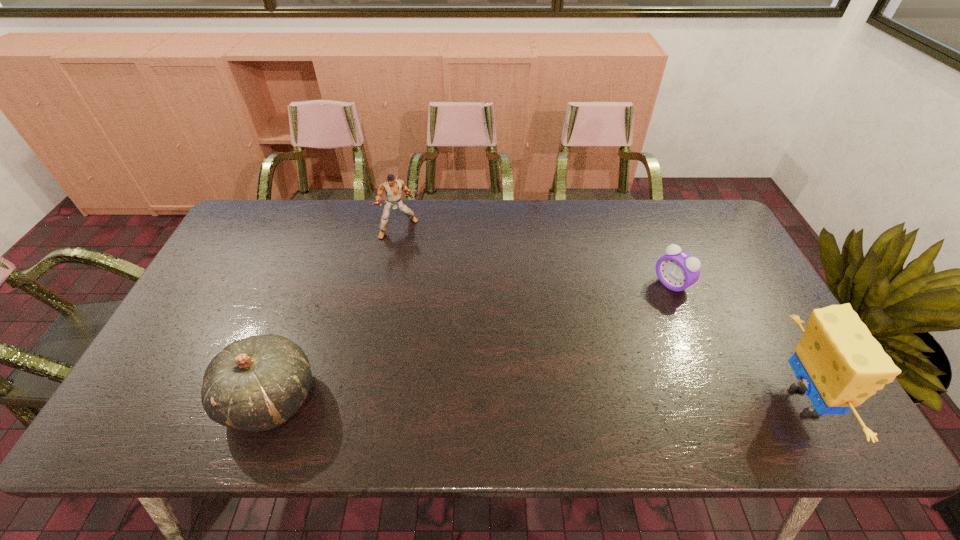
You are a GUI agent. You are given a task and a screenshot of the screen. Output one action in this format:
    pyautogui.click(x=<x>, y=<y>)
    Task: Click on the vacant space located 0.160m on the face of the third nearest object
    The height and width of the screenshot is (540, 960).
    Given the screenshot: What is the action you would take?
    point(621,316)

Locate an element on the screen. The height and width of the screenshot is (540, 960). vacant region located on the face of the third nearest object is located at coordinates (578, 343).

Find the location of a particular element. vacant region located on the front-facing side of the third object from right to left is located at coordinates (443, 301).

You are a GUI agent. You are given a task and a screenshot of the screen. Output one action in this format:
    pyautogui.click(x=<x>, y=<y>)
    Task: Click on the vacant region located 0.150m on the front-facing side of the third object from right to left
    
    Given the screenshot: What is the action you would take?
    pyautogui.click(x=422, y=268)

Identify the location of vacant space located on the front-facing side of the third object from right to left. The width and height of the screenshot is (960, 540). (414, 254).

Find the location of a particular element. This screenshot has width=960, height=540. object positioned at the far edge is located at coordinates (392, 188).

Identify the location of gourd at the near edge. (257, 383).

Where is `sponge at the near edge`? The width and height of the screenshot is (960, 540). sponge at the near edge is located at coordinates (841, 364).

You are a GUI agent. You are given a task and a screenshot of the screen. Output one action in this format:
    pyautogui.click(x=<x>, y=<y>)
    Task: Click on the object present at the right edge
    The height and width of the screenshot is (540, 960).
    Given the screenshot: What is the action you would take?
    pyautogui.click(x=841, y=364)

Where is `object that is at the near right corner`? The image size is (960, 540). object that is at the near right corner is located at coordinates (841, 364).